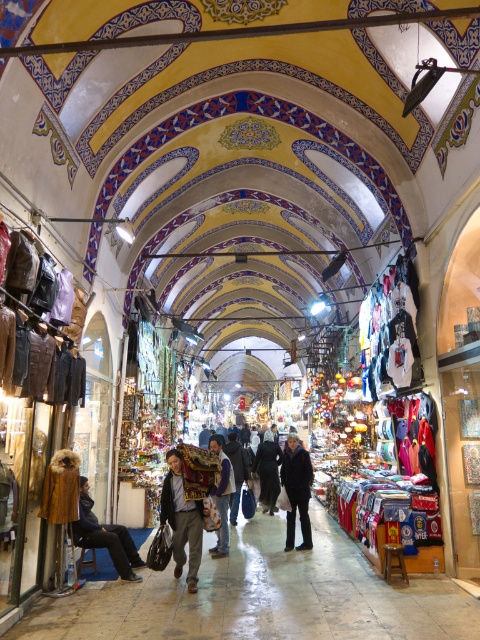
Question: Is dark blue fabric jacket at lower left thinner than dark gray pants at center?

Choices:
 (A) yes
 (B) no

Answer: (B)

Question: Considering the real-world distances, which object is closest to the dark gray pants at center?

Choices:
 (A) leather jacket at center
 (B) dark gray fabric jacket at center

Answer: (A)

Question: Can you confirm if leather jacket at center is wider than dark blue fabric at center?

Choices:
 (A) yes
 (B) no

Answer: (A)

Question: Does dark blue fabric jacket at lower left have a greater width compared to leather jacket at center?

Choices:
 (A) no
 (B) yes

Answer: (A)

Question: Which point is closer to the camera?

Choices:
 (A) (187, 525)
 (B) (84, 525)
 (C) (274, 468)

Answer: (A)

Question: Which of the following is the closest to the observer?

Choices:
 (A) dark gray pants at center
 (B) leather jacket at center
 (C) dark blue fabric jacket at lower left

Answer: (C)